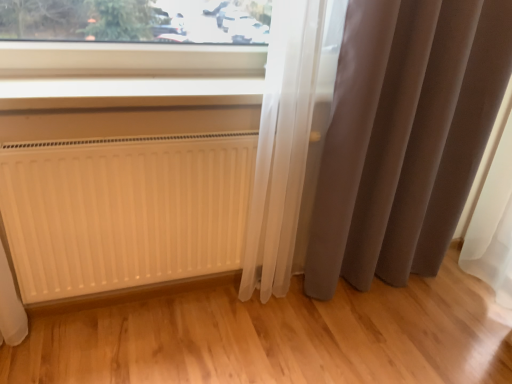
Identify the location of white matte radiator at lower left. The image size is (512, 384). (124, 210).

I want to click on white matte radiator at lower left, so click(124, 210).

Considering the sizes of white plastic window sill at upper center and white matte radiator at lower left in the image, is white plastic window sill at upper center bigger or smaller than white matte radiator at lower left?

In the image, white plastic window sill at upper center appears to be smaller than white matte radiator at lower left.

Which is behind, white plastic window sill at upper center or white matte radiator at lower left?

white matte radiator at lower left is behind.

The width and height of the screenshot is (512, 384). I want to click on window sill in front of the white matte radiator at lower left, so click(127, 92).

Is white plastic window sill at upper center oriented away from white matte radiator at lower left?

No, white plastic window sill at upper center's orientation is not away from white matte radiator at lower left.

Is white plastic window sill at upper center located outside matte gray curtain at right?

Yes.

Is white plastic window sill at upper center directly adjacent to matte gray curtain at right?

There is a gap between white plastic window sill at upper center and matte gray curtain at right.

Looking at this image, which object is thinner, white plastic window sill at upper center or matte gray curtain at right?

With smaller width is matte gray curtain at right.

Does white matte radiator at lower left turn towards white plastic window sill at upper center?

No, white matte radiator at lower left is not facing towards white plastic window sill at upper center.

Can we say white matte radiator at lower left lies outside white plastic window sill at upper center?

Yes, white matte radiator at lower left is outside of white plastic window sill at upper center.

From the image's perspective, who appears lower, white matte radiator at lower left or white plastic window sill at upper center?

From the image's view, white matte radiator at lower left is below.

Can you confirm if white matte radiator at lower left is smaller than white plastic window sill at upper center?

No, white matte radiator at lower left is not smaller than white plastic window sill at upper center.

Is matte gray curtain at right oriented away from white matte radiator at lower left?

No, white matte radiator at lower left is not at the back of matte gray curtain at right.

Between matte gray curtain at right and white matte radiator at lower left, which one has smaller width?

white matte radiator at lower left is thinner.

Can you tell me how much matte gray curtain at right and white matte radiator at lower left differ in facing direction?

There is a 2.89-degree angle between the facing directions of matte gray curtain at right and white matte radiator at lower left.

Based on the photo, from the image's perspective, which one is positioned higher, matte gray curtain at right or white matte radiator at lower left?

matte gray curtain at right is shown above in the image.

Is matte gray curtain at right in contact with white plastic window sill at upper center?

No.

In the image, is matte gray curtain at right positioned in front of or behind white plastic window sill at upper center?

Visually, matte gray curtain at right is located in front of white plastic window sill at upper center.

Does point (400, 274) appear closer or farther from the camera than point (149, 91)?

Point (400, 274) is farther from the camera than point (149, 91).

Does point (164, 260) come in front of point (426, 48)?

No, (164, 260) is behind (426, 48).

From the image's perspective, would you say white matte radiator at lower left is shown under matte gray curtain at right?

Indeed, from the image's perspective, white matte radiator at lower left is shown beneath matte gray curtain at right.

Consider the image. Would you consider white matte radiator at lower left to be distant from matte gray curtain at right?

Actually, white matte radiator at lower left and matte gray curtain at right are a little close together.

Locate an element on the screen. This screenshot has width=512, height=384. radiator that appears below the white plastic window sill at upper center (from the image's perspective) is located at coordinates (124, 210).

You are a GUI agent. You are given a task and a screenshot of the screen. Output one action in this format:
    pyautogui.click(x=<x>, y=<y>)
    Task: Click on the curtain in front of the white plastic window sill at upper center
    This screenshot has height=384, width=512.
    Given the screenshot: What is the action you would take?
    pyautogui.click(x=405, y=136)

Considering their positions, is matte gray curtain at right positioned closer to white plastic window sill at upper center than white matte radiator at lower left?

Among the two, white matte radiator at lower left is located nearer to white plastic window sill at upper center.

Which object lies nearer to the anchor point white matte radiator at lower left, matte gray curtain at right or white plastic window sill at upper center?

Based on the image, white plastic window sill at upper center appears to be nearer to white matte radiator at lower left.

From the image, which object appears to be farther from matte gray curtain at right, white matte radiator at lower left or white plastic window sill at upper center?

The object further to matte gray curtain at right is white plastic window sill at upper center.

Estimate the real-world distances between objects in this image. Which object is closer to matte gray curtain at right, white plastic window sill at upper center or white matte radiator at lower left?

The object closer to matte gray curtain at right is white matte radiator at lower left.

From the image, which object appears to be farther from white matte radiator at lower left, white plastic window sill at upper center or matte gray curtain at right?

matte gray curtain at right.

Based on their spatial positions, is white matte radiator at lower left or matte gray curtain at right further from white plastic window sill at upper center?

The object further to white plastic window sill at upper center is matte gray curtain at right.

Locate an element on the screen. This screenshot has height=384, width=512. window sill located between white matte radiator at lower left and matte gray curtain at right in the left-right direction is located at coordinates (127, 92).